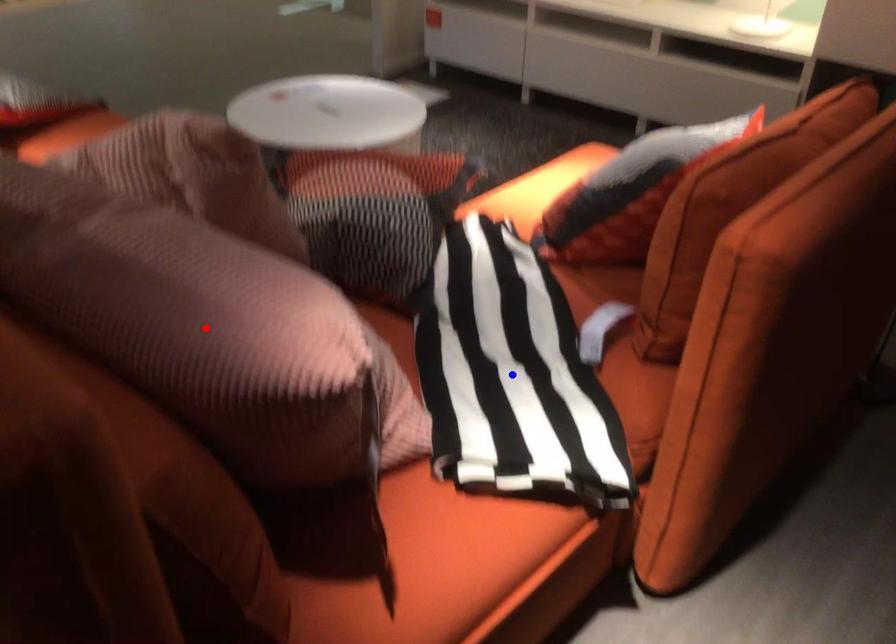
Question: In the image, two points are highlighted. Which point is nearer to the camera? Reply with the corresponding letter.

Choices:
 (A) blue point
 (B) red point

Answer: (B)